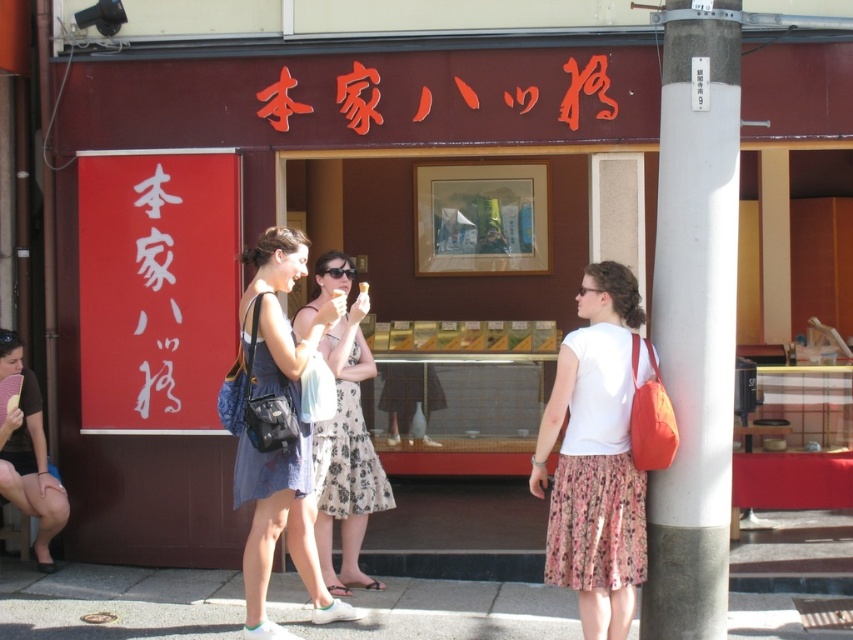
Is red matte sign at center above white creamy ice cream at center?

Yes.

Is point (358, 122) closer to camera compared to point (363, 291)?

No, it is behind (363, 291).

Who is more distant from viewer, (338, 83) or (367, 285)?

The point (367, 285) is behind.

This screenshot has width=853, height=640. In order to click on red matte sign at center in this screenshot , I will do `click(358, 97)`.

This screenshot has height=640, width=853. Find the location of `brown leather purse at lower left`. brown leather purse at lower left is located at coordinates (28, 456).

Is the position of brown leather purse at lower left more distant than that of white creamy ice cream at center?

Yes, it is behind white creamy ice cream at center.

Which is in front, point (24, 435) or point (358, 289)?

Point (24, 435) is in front.

Find the location of a particular element. This screenshot has width=853, height=640. brown leather purse at lower left is located at coordinates (28, 456).

The image size is (853, 640). What do you see at coordinates (595, 458) in the screenshot?
I see `white cotton shirt at center` at bounding box center [595, 458].

Between point (633, 508) and point (367, 291), which one is positioned behind?

Positioned behind is point (367, 291).

The height and width of the screenshot is (640, 853). Identify the location of white cotton shirt at center. (595, 458).